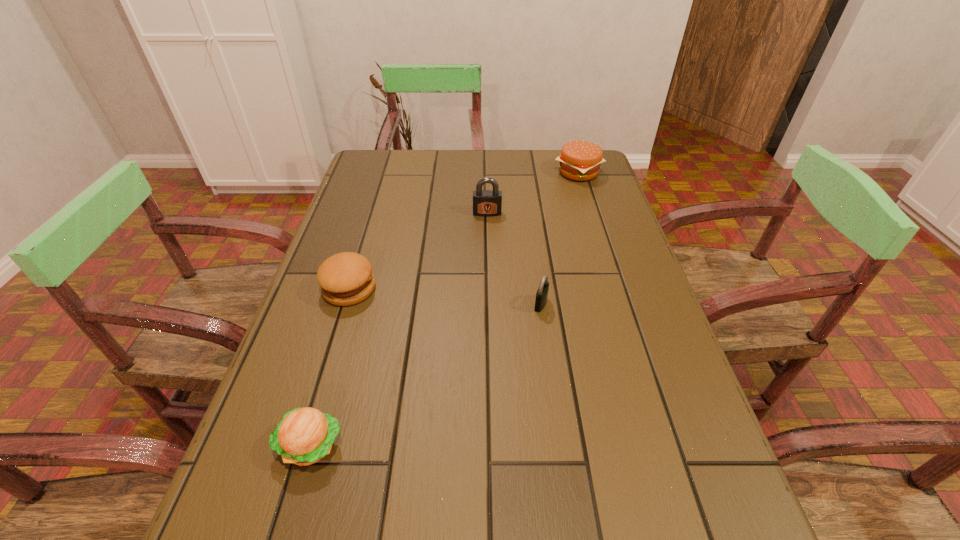
Find the location of `vacant area that lies between the shorter padlock and the rightmost hamburger`. vacant area that lies between the shorter padlock and the rightmost hamburger is located at coordinates (560, 238).

Find the location of a particular element. free spot between the rightmost object and the right padlock is located at coordinates (560, 238).

I want to click on free space between the fourth nearest object and the second object from right to left, so click(x=514, y=259).

Locate an element on the screen. The width and height of the screenshot is (960, 540). free spot between the rightmost object and the nearest hamburger is located at coordinates (444, 309).

You are a GUI agent. You are given a task and a screenshot of the screen. Output one action in this format:
    pyautogui.click(x=<x>, y=<y>)
    Task: Click on the empty space between the third object from left to right and the farthest object
    
    Given the screenshot: What is the action you would take?
    pyautogui.click(x=533, y=193)

You are a GUI agent. You are given a task and a screenshot of the screen. Output one action in this format:
    pyautogui.click(x=<x>, y=<y>)
    Task: Click on the free space between the shorter padlock and the nearest hamburger
    Image resolution: width=960 pixels, height=540 pixels.
    Given the screenshot: What is the action you would take?
    pyautogui.click(x=426, y=375)

Image resolution: width=960 pixels, height=540 pixels. Identify the location of vacant space that's between the fourth object from left to right and the second nearest hamburger. (445, 296).

You are a GUI agent. You are given a task and a screenshot of the screen. Output one action in this format:
    pyautogui.click(x=<x>, y=<y>)
    Task: Click on the free spot between the second nearest hamburger and the tallest object
    This screenshot has width=960, height=540.
    Given the screenshot: What is the action you would take?
    pyautogui.click(x=419, y=251)

Find the location of `empty space that is in between the right padlock and the taller padlock`. empty space that is in between the right padlock and the taller padlock is located at coordinates (514, 259).

Where is `empty location between the shorter padlock and the rightmost object`? The height and width of the screenshot is (540, 960). empty location between the shorter padlock and the rightmost object is located at coordinates (560, 238).